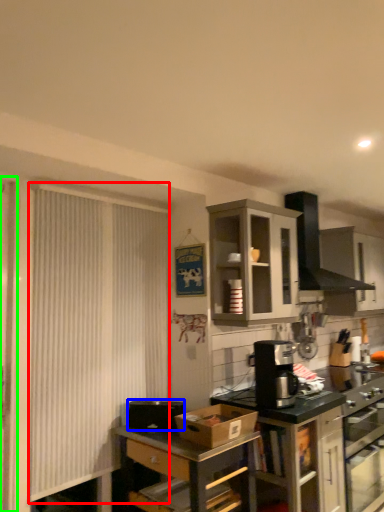
Question: Which object is positioned closest to curtain (highlighted by a red box)? Select from appliance (highlighted by a blue box) and screen door (highlighted by a green box).

Choices:
 (A) appliance
 (B) screen door

Answer: (B)